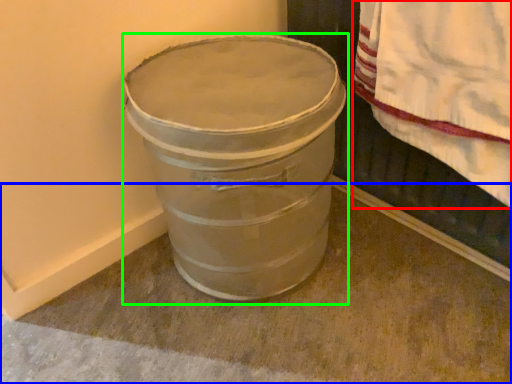
Question: Estimate the real-world distances between objects in this image. Which object is farther from blanket (highlighted by a red box), concrete (highlighted by a blue box) or waste container (highlighted by a green box)?

Choices:
 (A) concrete
 (B) waste container

Answer: (A)